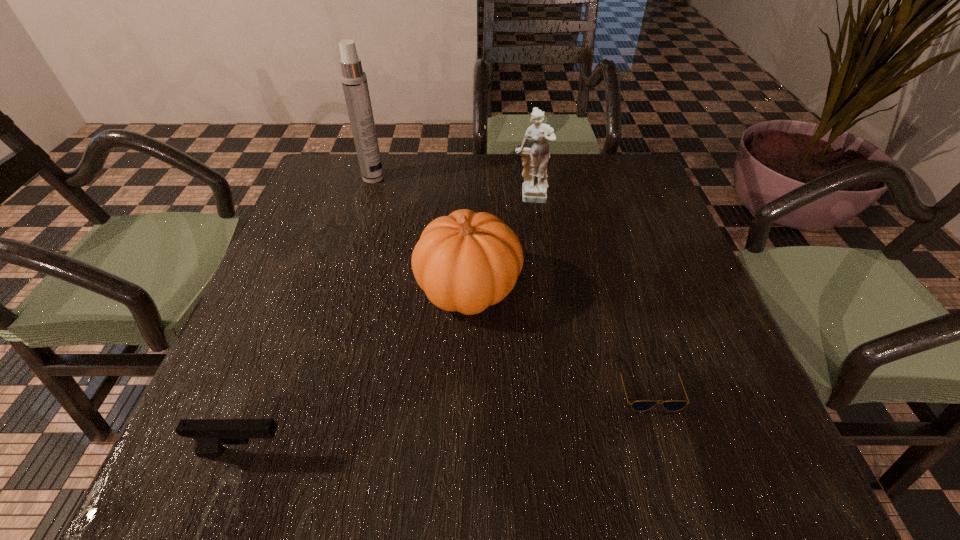
This screenshot has height=540, width=960. In order to click on vacant space located 0.110m on the front of the tallest object in this screenshot , I will do pos(364,208).

This screenshot has width=960, height=540. What are the coordinates of `vacant space located 0.200m on the front-facing side of the fourth nearest object` in the screenshot? It's located at (539, 266).

Find the location of a particular element. blank space located on the front of the pumpkin is located at coordinates (465, 442).

Locate an element on the screen. This screenshot has width=960, height=540. blank space located 0.220m on the front-facing side of the nearest object is located at coordinates (434, 452).

Identify the location of vacant space located 0.050m on the front-facing side of the rightmost object. (665, 441).

Identify the location of aerosol can present at the far edge. (354, 81).

Where is `figurine that is at the far edge`? This screenshot has width=960, height=540. figurine that is at the far edge is located at coordinates (535, 159).

Identify the location of object that is at the near edge. pyautogui.click(x=210, y=435).

Find the location of a particular element. aerosol can present at the left edge is located at coordinates (354, 81).

The height and width of the screenshot is (540, 960). I want to click on pistol that is at the left edge, so click(210, 435).